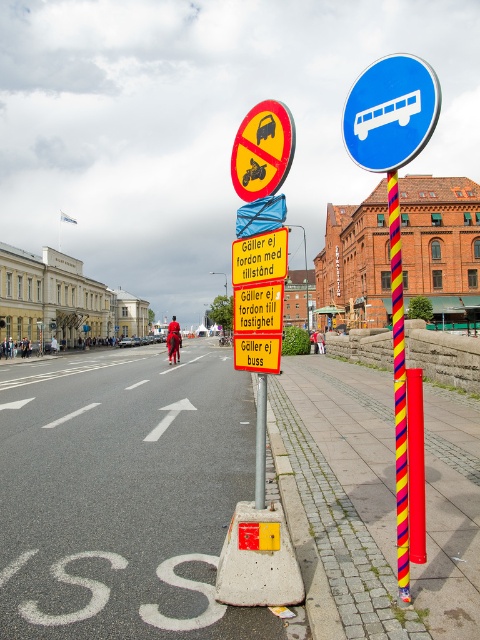
Question: Can you confirm if blue plastic bus at upper center is positioned above multicolored striped pole at center?

Choices:
 (A) yes
 (B) no

Answer: (A)

Question: Which point appears farthest from the camera in this image?

Choices:
 (A) (36, 580)
 (B) (406, 531)

Answer: (A)

Question: Among these objects, which one is nearest to the camera?

Choices:
 (A) blue plastic bus at upper center
 (B) paved concrete sidewalk at lower center

Answer: (A)

Question: Can you confirm if paved concrete sidewalk at lower center is wider than blue plastic bus at upper center?

Choices:
 (A) no
 (B) yes

Answer: (B)

Question: Does blue plastic bus at upper center have a smaller size compared to multicolored striped pole at center?

Choices:
 (A) yes
 (B) no

Answer: (A)

Question: Which point is closer to the camera taking this photo?

Choices:
 (A) (393, 307)
 (B) (349, 154)
 (C) (21, 452)

Answer: (B)